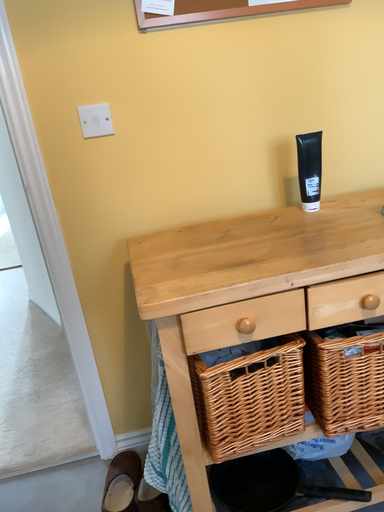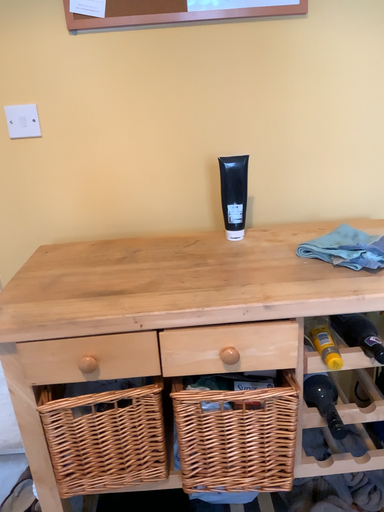
Question: Which way did the camera rotate in the video?

Choices:
 (A) rotated right
 (B) rotated left

Answer: (B)